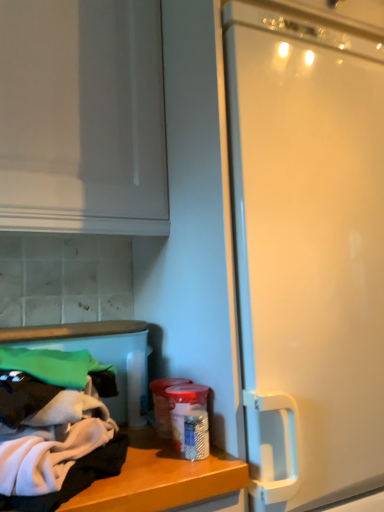
Question: Does translucent plastic container at lower center have a larger size compared to white soft cloth at lower left?

Choices:
 (A) yes
 (B) no

Answer: (B)

Question: Is the depth of translucent plastic container at lower center less than that of white soft cloth at lower left?

Choices:
 (A) no
 (B) yes

Answer: (A)

Question: Does translucent plastic container at lower center have a smaller size compared to white soft cloth at lower left?

Choices:
 (A) no
 (B) yes

Answer: (B)

Question: Is white soft cloth at lower left inside translucent plastic container at lower center?

Choices:
 (A) no
 (B) yes

Answer: (A)

Question: Is translucent plastic container at lower center positioned with its back to white soft cloth at lower left?

Choices:
 (A) no
 (B) yes

Answer: (A)

Question: Is translucent plastic container at lower center thinner than white soft cloth at lower left?

Choices:
 (A) yes
 (B) no

Answer: (A)

Question: Can we say white soft cloth at lower left lies outside translucent plastic container at lower center?

Choices:
 (A) yes
 (B) no

Answer: (A)

Question: From the image's perspective, is white soft cloth at lower left below translucent plastic container at lower center?

Choices:
 (A) no
 (B) yes

Answer: (A)

Question: Does white soft cloth at lower left have a lesser width compared to translucent plastic container at lower center?

Choices:
 (A) no
 (B) yes

Answer: (A)

Question: Is white soft cloth at lower left not close to translucent plastic container at lower center?

Choices:
 (A) no
 (B) yes

Answer: (A)

Question: Could you tell me if white soft cloth at lower left is turned towards translucent plastic container at lower center?

Choices:
 (A) no
 (B) yes

Answer: (A)

Question: Can you confirm if white soft cloth at lower left is positioned to the right of translucent plastic container at lower center?

Choices:
 (A) yes
 (B) no

Answer: (B)

Question: Is point (196, 392) closer or farther from the camera than point (21, 431)?

Choices:
 (A) closer
 (B) farther

Answer: (B)